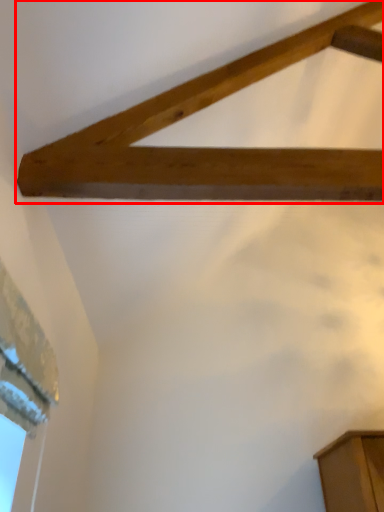
Question: From the image's perspective, where is plank (annotated by the red box) located relative to window?

Choices:
 (A) above
 (B) below

Answer: (A)